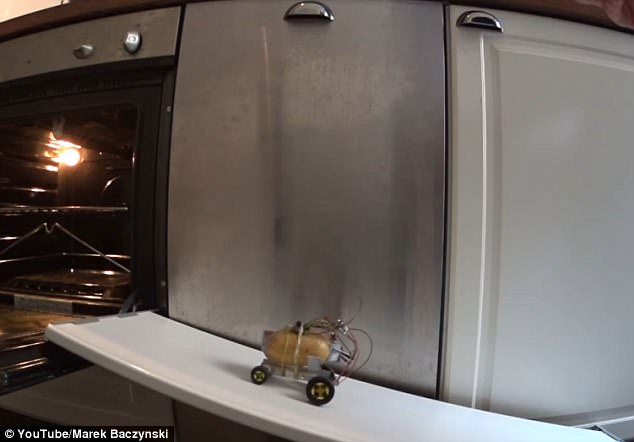
I want to click on oven light, so click(x=68, y=160).